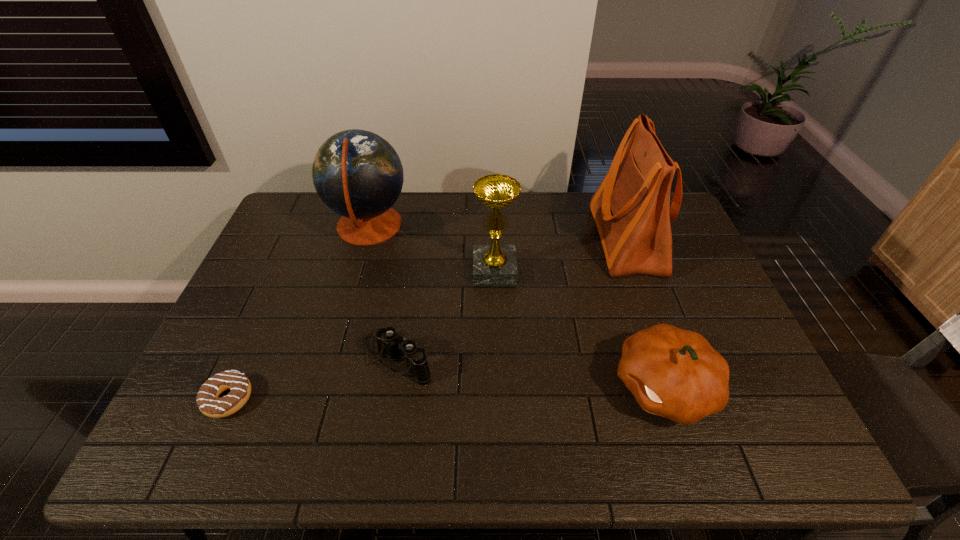
The width and height of the screenshot is (960, 540). What are the coordinates of `free spot located on the front pocket of the shopping bag` in the screenshot? It's located at (558, 240).

I want to click on vacant space located with the Americas facing the viewer on the globe, so click(x=424, y=227).

What are the coordinates of `vacant space located on the front-facing side of the fourth object from left to right` in the screenshot? It's located at (498, 384).

Where is `free location located 0.350m on the front face of the fourth tallest object`? The width and height of the screenshot is (960, 540). free location located 0.350m on the front face of the fourth tallest object is located at coordinates (468, 387).

Identify the location of free location located on the front face of the fourth tallest object. (472, 387).

Find the location of a particular element. The width and height of the screenshot is (960, 540). free space located 0.350m on the front face of the fourth tallest object is located at coordinates [x=468, y=387].

The image size is (960, 540). In order to click on vacant space located 0.340m on the back of the fifth tallest object in this screenshot , I will do `click(414, 247)`.

Image resolution: width=960 pixels, height=540 pixels. Find the location of `free space located on the back of the doughnut`. free space located on the back of the doughnut is located at coordinates (278, 287).

What are the coordinates of `shopping bag located in the far edge section of the desktop` in the screenshot? It's located at (631, 208).

This screenshot has height=540, width=960. In order to click on globe that is at the far edge in this screenshot , I will do `click(357, 174)`.